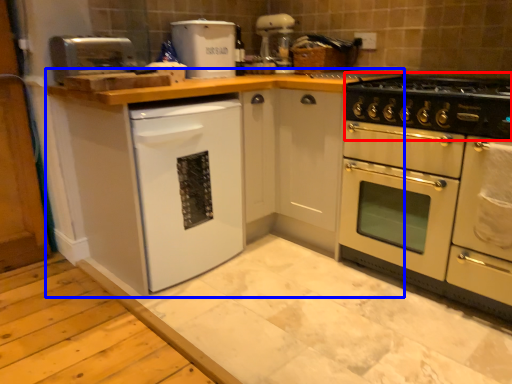
Question: Which point is further to the camera, gas stove (highlighted by a red box) or cabinetry (highlighted by a blue box)?

Choices:
 (A) gas stove
 (B) cabinetry

Answer: (A)